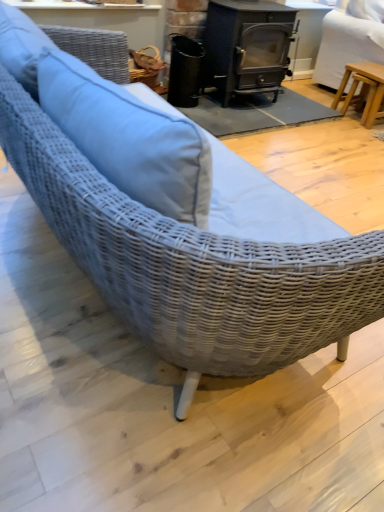
Question: Relative to light brown wooden stool at right, is light brown wooden stool at right in front or behind?

Choices:
 (A) front
 (B) behind

Answer: (B)

Question: From the image's perspective, is light brown wooden stool at right positioned above or below light brown wooden stool at right?

Choices:
 (A) below
 (B) above

Answer: (A)

Question: Which of these objects is positioned farthest from the light brown wooden stool at right?

Choices:
 (A) light brown wooden stool at right
 (B) black cast iron wood burning stove at center
 (C) black matte trash can at center

Answer: (C)

Question: Which object is the closest to the light brown wooden stool at right?

Choices:
 (A) black cast iron wood burning stove at center
 (B) light brown wooden stool at right
 (C) black matte trash can at center

Answer: (B)